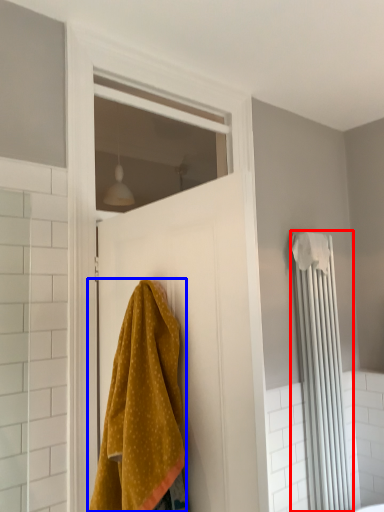
Question: Which point is closer to the camera, shower curtain (highlighted by a red box) or towel (highlighted by a blue box)?

Choices:
 (A) shower curtain
 (B) towel

Answer: (B)